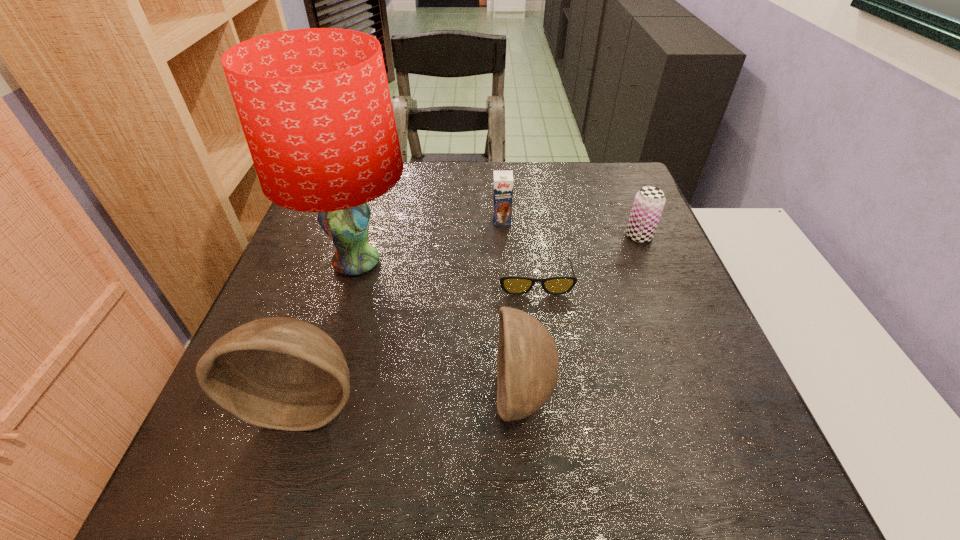
This screenshot has width=960, height=540. Identify the location of free space located on the back of the rightmost object. (610, 165).

Image resolution: width=960 pixels, height=540 pixels. I want to click on vacant space located on the front-facing side of the tallest object, so coord(308,427).

This screenshot has height=540, width=960. What are the coordinates of `free space located on the front-facing side of the sunglasses` in the screenshot? It's located at (549, 394).

Find the location of `vacant space positioned 0.060m on the front label of the chocolate milk`. vacant space positioned 0.060m on the front label of the chocolate milk is located at coordinates (503, 240).

Identify the location of bowl that is at the left edge. This screenshot has width=960, height=540. [x=281, y=373].

This screenshot has height=540, width=960. I want to click on lampshade located at the left edge, so click(x=314, y=104).

Locate an element on the screen. object that is at the right edge is located at coordinates click(x=649, y=202).

You are a GUI agent. You are given a task and a screenshot of the screen. Output one action in this format:
    pyautogui.click(x=<x>, y=<y>)
    Task: Click on the object present at the near left corner
    The width and height of the screenshot is (960, 540).
    Given the screenshot: What is the action you would take?
    pyautogui.click(x=281, y=373)

Where is `vacant area at the far edge of the desktop`? vacant area at the far edge of the desktop is located at coordinates pos(528,178).

This screenshot has height=540, width=960. In order to click on blank area at the near edge in this screenshot , I will do `click(413, 403)`.